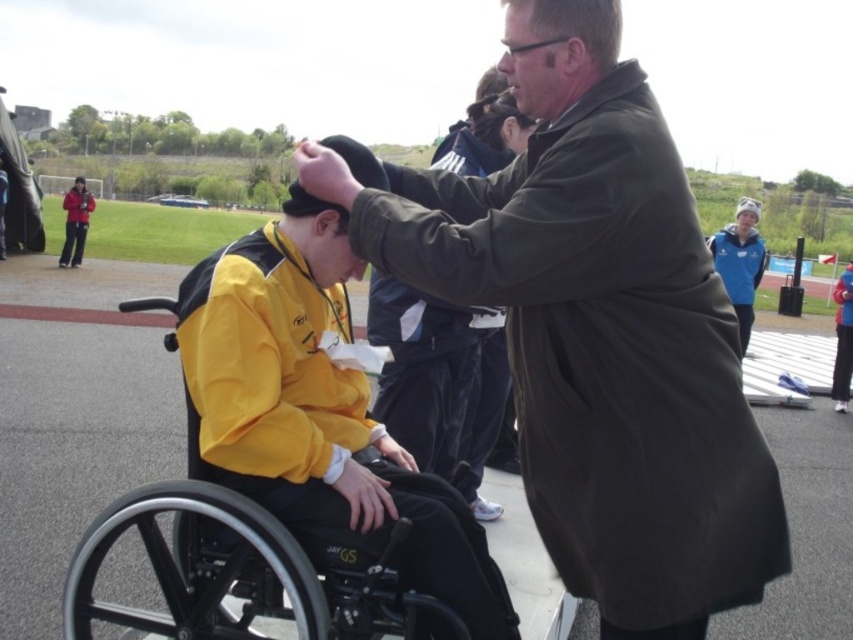
Question: Is the position of dark green coat at center more distant than that of matte black jacket at left?

Choices:
 (A) no
 (B) yes

Answer: (A)

Question: Which of the following is the farthest from the observer?

Choices:
 (A) matte black jacket at left
 (B) red fabric robe at lower right

Answer: (A)

Question: Can you confirm if blue fleece jacket at upper right is positioned below matte black jacket at left?

Choices:
 (A) yes
 (B) no

Answer: (A)

Question: Which point is closer to the camera?

Choices:
 (A) blue fleece jacket at upper right
 (B) dark green matte coat at upper right
 (C) dark green coat at center
 (D) yellow matte jacket at center

Answer: (C)

Question: Which point is closer to the camera?

Choices:
 (A) blue fleece jacket at upper right
 (B) dark green matte coat at upper right

Answer: (B)

Question: Is dark green coat at center to the right of red fabric robe at lower right from the viewer's perspective?

Choices:
 (A) yes
 (B) no

Answer: (B)